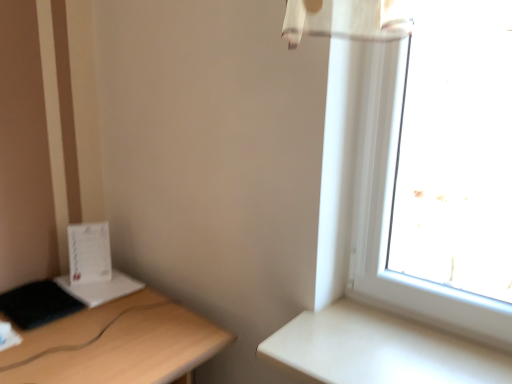
Question: Would you say light wood desk at left contains white matte table at right?

Choices:
 (A) yes
 (B) no

Answer: (B)

Question: Considering the relative sizes of light wood desk at left and white matte table at right in the image provided, is light wood desk at left smaller than white matte table at right?

Choices:
 (A) yes
 (B) no

Answer: (B)

Question: Can you confirm if light wood desk at left is wider than white matte table at right?

Choices:
 (A) no
 (B) yes

Answer: (B)

Question: Is light wood desk at left aimed at white matte table at right?

Choices:
 (A) yes
 (B) no

Answer: (A)

Question: Can you confirm if light wood desk at left is taller than white matte table at right?

Choices:
 (A) no
 (B) yes

Answer: (B)

Question: Is there a large distance between light wood desk at left and white matte table at right?

Choices:
 (A) yes
 (B) no

Answer: (B)

Question: From a real-world perspective, is white matte table at right on top of light wood desk at left?

Choices:
 (A) yes
 (B) no

Answer: (A)

Question: Is white matte table at right beside light wood desk at left?

Choices:
 (A) no
 (B) yes

Answer: (A)

Question: Is white matte table at right at the left side of light wood desk at left?

Choices:
 (A) no
 (B) yes

Answer: (A)

Question: Can you confirm if white matte table at right is smaller than light wood desk at left?

Choices:
 (A) yes
 (B) no

Answer: (A)

Question: Is light wood desk at left located within white matte table at right?

Choices:
 (A) yes
 (B) no

Answer: (B)

Question: Would you say white matte table at right is outside light wood desk at left?

Choices:
 (A) no
 (B) yes

Answer: (B)

Question: From their relative heights in the image, would you say light wood desk at left is taller or shorter than white matte table at right?

Choices:
 (A) tall
 (B) short

Answer: (A)